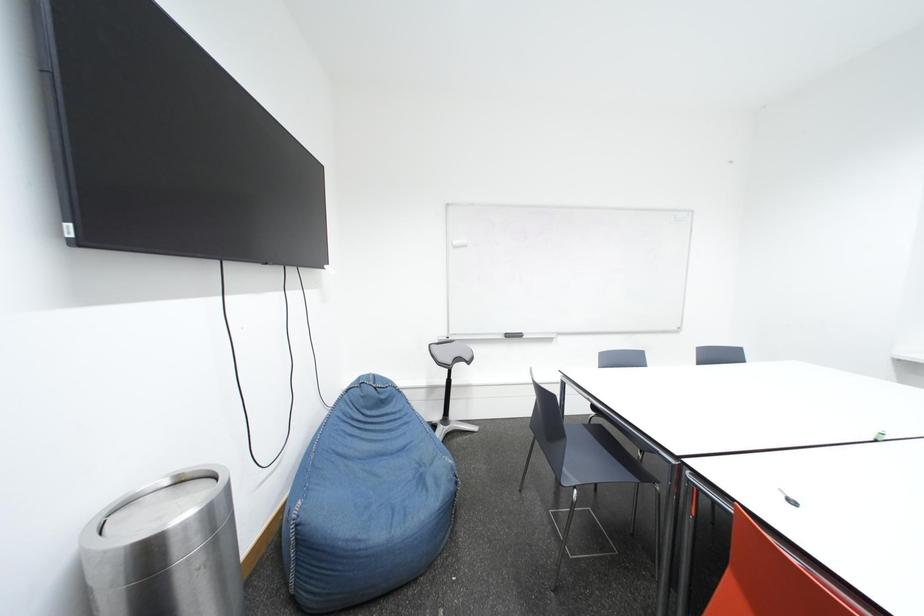
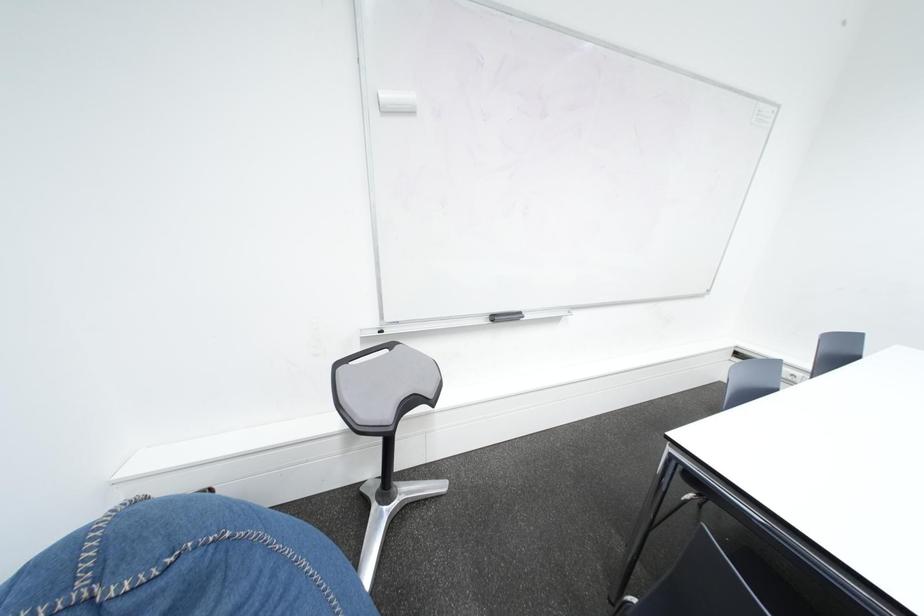
Question: In a continuous first-person perspective shot, in which direction is the camera moving?

Choices:
 (A) Left
 (B) Right
 (C) Forward
 (D) Backward

Answer: (C)